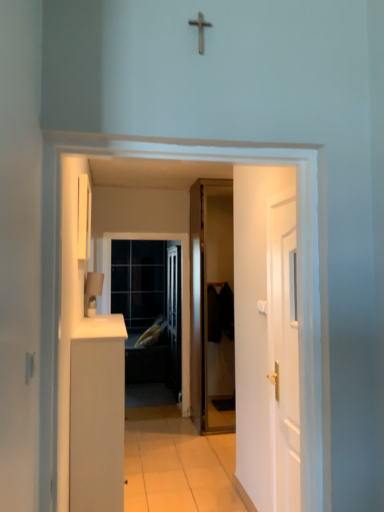
Find the location of a particular element. Image resolution: width=384 pixels, height=512 pixels. free point above matte glass screen door at center (from a real-world perspective) is located at coordinates (143, 231).